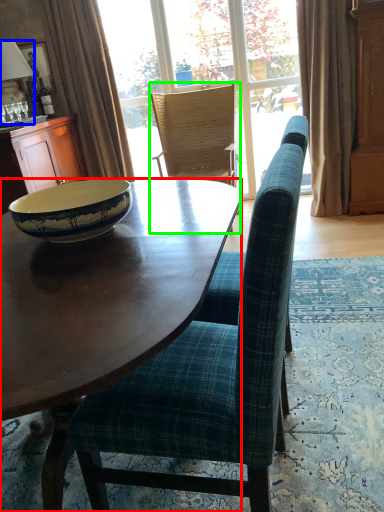
Question: Which is nearer to the desk (highlighted by a red box)? lamp (highlighted by a blue box) or chair (highlighted by a green box).

Choices:
 (A) lamp
 (B) chair

Answer: (B)